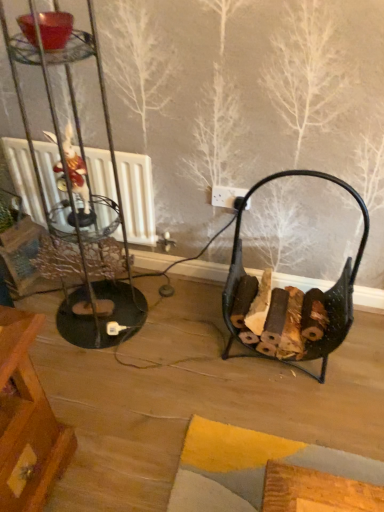
Question: Can you confirm if black metal firewood basket at lower right is taller than white plastic socket at center?

Choices:
 (A) yes
 (B) no

Answer: (A)

Question: Considering the relative positions of black metal firewood basket at lower right and white plastic socket at center in the image provided, is black metal firewood basket at lower right to the left of white plastic socket at center from the viewer's perspective?

Choices:
 (A) no
 (B) yes

Answer: (A)

Question: From the image's perspective, is black metal firewood basket at lower right beneath white plastic socket at center?

Choices:
 (A) no
 (B) yes

Answer: (B)

Question: From a real-world perspective, is black metal firewood basket at lower right physically above white plastic socket at center?

Choices:
 (A) no
 (B) yes

Answer: (A)

Question: Can you see black metal firewood basket at lower right touching white plastic socket at center?

Choices:
 (A) yes
 (B) no

Answer: (B)

Question: Could you tell me if black metal firewood basket at lower right is turned towards white plastic socket at center?

Choices:
 (A) yes
 (B) no

Answer: (B)

Question: From the image's perspective, is white plastic socket at center below black metal firewood basket at lower right?

Choices:
 (A) no
 (B) yes

Answer: (A)

Question: Can you confirm if white plastic socket at center is positioned to the right of black metal firewood basket at lower right?

Choices:
 (A) yes
 (B) no

Answer: (B)

Question: Considering the relative positions of white plastic socket at center and black metal firewood basket at lower right in the image provided, is white plastic socket at center to the left of black metal firewood basket at lower right from the viewer's perspective?

Choices:
 (A) yes
 (B) no

Answer: (A)

Question: Is white plastic socket at center aimed at black metal firewood basket at lower right?

Choices:
 (A) yes
 (B) no

Answer: (B)

Question: Is white plastic socket at center positioned behind black metal firewood basket at lower right?

Choices:
 (A) yes
 (B) no

Answer: (A)

Question: Does white plastic socket at center have a lesser height compared to black metal firewood basket at lower right?

Choices:
 (A) yes
 (B) no

Answer: (A)

Question: Is black metal firewood basket at lower right wider or thinner than white plastic socket at center?

Choices:
 (A) wide
 (B) thin

Answer: (A)